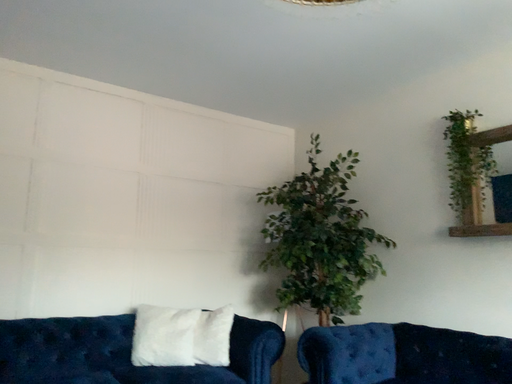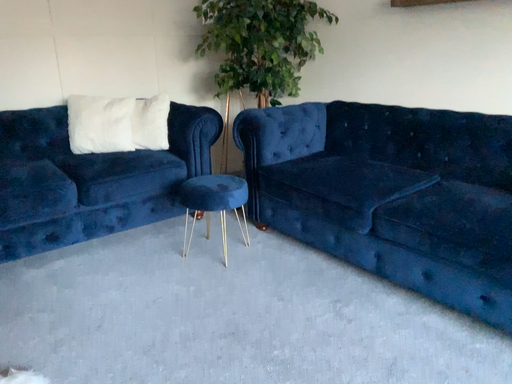
Question: Which way did the camera rotate in the video?

Choices:
 (A) rotated downward
 (B) rotated upward

Answer: (A)